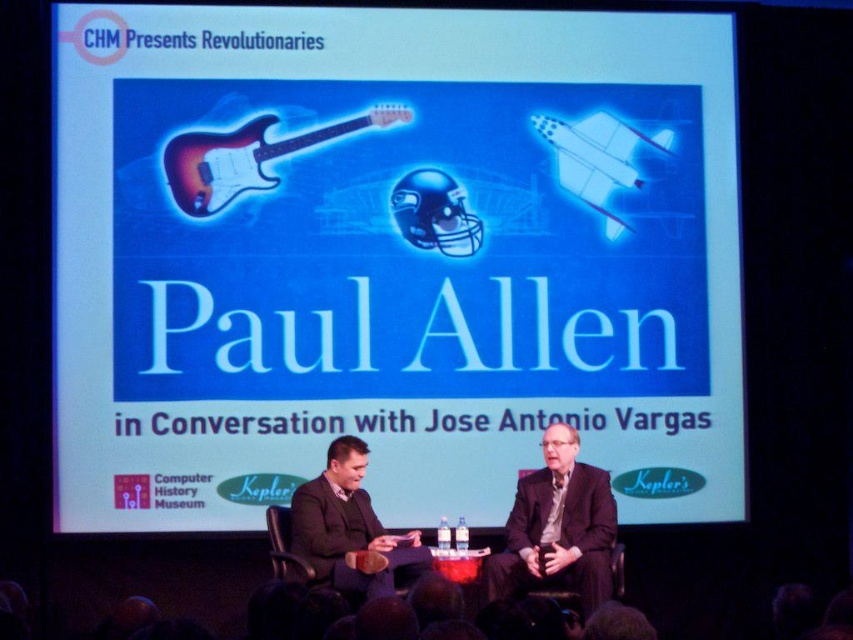
Consider the image. Who is higher up, dark suit at center or satin wood electric guitar at center?

satin wood electric guitar at center

Does dark suit at center have a greater width compared to satin wood electric guitar at center?

No, dark suit at center is not wider than satin wood electric guitar at center.

This screenshot has width=853, height=640. Describe the element at coordinates (558, 529) in the screenshot. I see `dark suit at center` at that location.

The image size is (853, 640). Identify the location of dark suit at center. (558, 529).

Can you confirm if dark gray suit at center is smaller than glossy blue football helmet at center?

No.

Which is in front, point (363, 467) or point (430, 224)?

Point (363, 467) is in front.

Image resolution: width=853 pixels, height=640 pixels. Find the location of `dark gray suit at center`. dark gray suit at center is located at coordinates (349, 528).

Is dark suit at center to the left of dark gray suit at center from the viewer's perspective?

In fact, dark suit at center is to the right of dark gray suit at center.

Between dark suit at center and dark gray suit at center, which one appears on the left side from the viewer's perspective?

dark gray suit at center is more to the left.

Where is `dark suit at center`? This screenshot has height=640, width=853. dark suit at center is located at coordinates (558, 529).